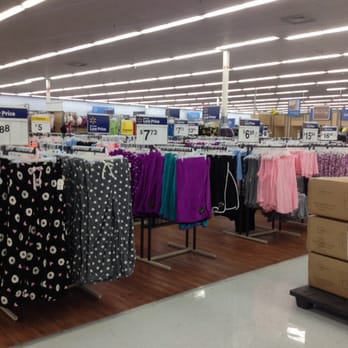
What are the coordinates of `clothing rack bases` in the screenshot? It's located at (249, 236), (285, 230), (201, 251), (161, 265), (93, 293), (15, 315).